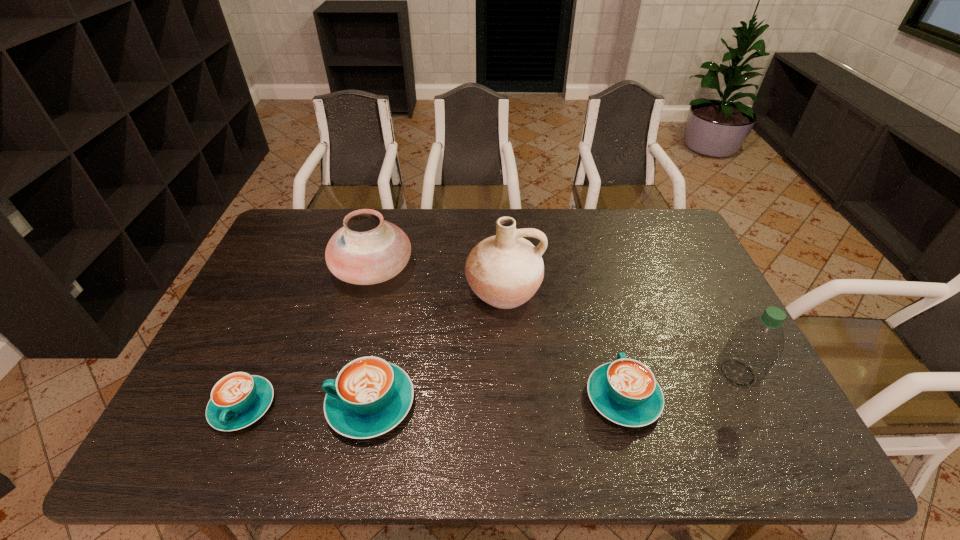
At what (x,y) coordinates should I click in order to perform the action: click on free point located 0.170m with the handle on the right side of the second cappuccino from left to right. Please return your answer as a coordinate pair (x, y). The image size is (960, 540). Looking at the image, I should click on (257, 403).

Image resolution: width=960 pixels, height=540 pixels. Find the location of `vacant space located 0.220m with the handle on the right side of the second cappuccino from left to right`. vacant space located 0.220m with the handle on the right side of the second cappuccino from left to right is located at coordinates (236, 403).

I want to click on free space located with the handle on the right side of the second object from right to left, so click(601, 315).

The image size is (960, 540). I want to click on vacant space located with the handle on the right side of the second object from right to left, so click(x=591, y=278).

The width and height of the screenshot is (960, 540). I want to click on vacant area situated 0.260m with the handle on the right side of the second object from right to left, so click(596, 296).

You are a GUI agent. You are given a task and a screenshot of the screen. Output one action in this format:
    pyautogui.click(x=<x>, y=<y>)
    Task: Click on the vacant area situated on the front of the shorter pottery
    
    Given the screenshot: What is the action you would take?
    pyautogui.click(x=353, y=343)

Where is `vacant space situated 0.300m to pour from the handle of the right pottery`? vacant space situated 0.300m to pour from the handle of the right pottery is located at coordinates pos(511,415).

In order to click on blank area located on the back of the rightmost object in this screenshot , I will do `click(718, 335)`.

This screenshot has width=960, height=540. What are the coordinates of `object situated at the far edge` in the screenshot? It's located at (367, 250).

Find the location of a particular element. Image resolution: width=960 pixels, height=540 pixels. water bottle that is at the near edge is located at coordinates (754, 346).